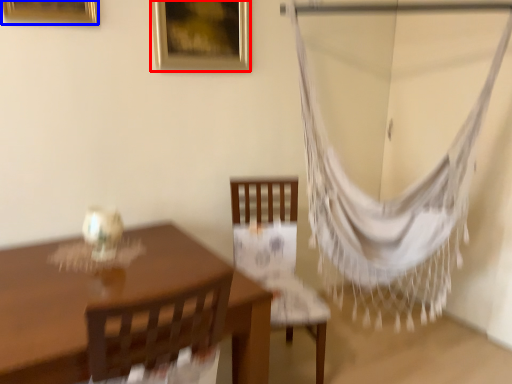
Question: Which object appears farthest to the camera in this image, picture frame (highlighted by a red box) or picture frame (highlighted by a blue box)?

Choices:
 (A) picture frame
 (B) picture frame

Answer: (A)